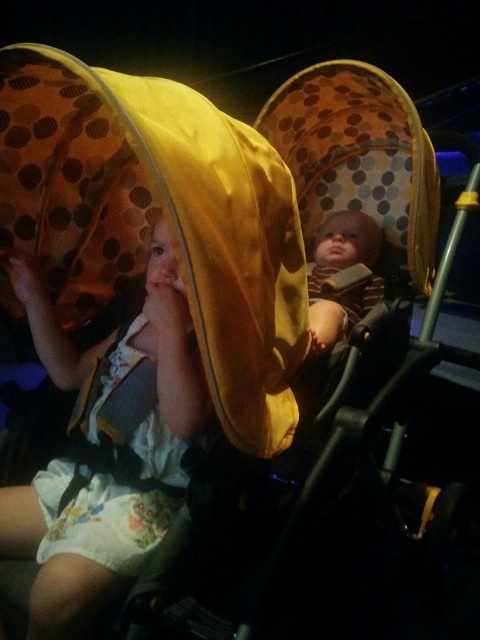
You are a photographer trying to capture a clear shot of both the matte yellow hood at upper left and the striped knit sweater at center in the dimly lit theater. Since the camera requires focusing on the taller object first for better lighting adjustment, which object should you focus on first?

The matte yellow hood at upper left is taller than the striped knit sweater at center, so you should focus on the matte yellow hood at upper left first for better lighting adjustment.

You are a photographer trying to capture a clear photo of both the matte yellow hood at upper left and the striped knit sweater at center. Since the lighting is dim, you want to ensure both are in focus. Which object should you focus on first to ensure depth of field captures both?

The matte yellow hood at upper left is closer to the viewer than the striped knit sweater at center. To ensure both are in focus, you should focus on the matte yellow hood at upper left first, as it is closer, and the depth of field will extend backward to include the striped knit sweater at center.

You are a photographer trying to capture a closeup shot of the yellow fabric blanket at upper left and the matte yellow hood at upper left. Since the camera can only focus on one object at a time, which object should you choose to ensure the larger object is in focus?

The yellow fabric blanket at upper left is larger than the matte yellow hood at upper left, so you should focus the camera on the yellow fabric blanket at upper left to ensure the larger object is in focus.